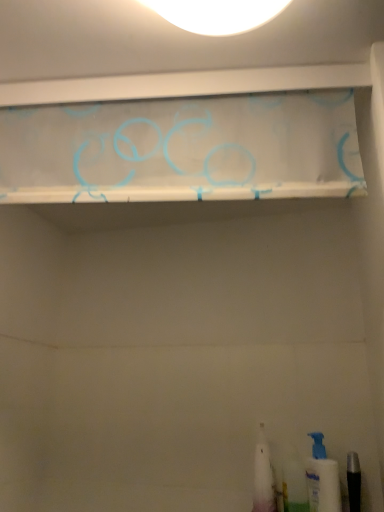
Question: Is white plastic toothbrush at lower right, positioned as the 3th toiletry in right-to-left order, taller than white plastic pump bottle at lower right, acting as the 3th toiletry starting from the left?

Choices:
 (A) no
 (B) yes

Answer: (B)

Question: From a real-world perspective, is white plastic toothbrush at lower right, the 1th toiletry in the left-to-right sequence, beneath white plastic pump bottle at lower right, the first toiletry when ordered from right to left?

Choices:
 (A) yes
 (B) no

Answer: (B)

Question: Considering the relative sizes of white plastic toothbrush at lower right, the 1th toiletry in the left-to-right sequence, and white plastic pump bottle at lower right, the first toiletry when ordered from right to left, in the image provided, is white plastic toothbrush at lower right, the 1th toiletry in the left-to-right sequence, smaller than white plastic pump bottle at lower right, the first toiletry when ordered from right to left,?

Choices:
 (A) yes
 (B) no

Answer: (B)

Question: Is white plastic pump bottle at lower right, the first toiletry when ordered from right to left, at the back of white plastic toothbrush at lower right, positioned as the 3th toiletry in right-to-left order?

Choices:
 (A) yes
 (B) no

Answer: (B)

Question: Does white plastic toothbrush at lower right, the 1th toiletry in the left-to-right sequence, appear on the left side of white plastic pump bottle at lower right, the first toiletry when ordered from right to left?

Choices:
 (A) no
 (B) yes

Answer: (B)

Question: Are white plastic toothbrush at lower right, the 1th toiletry in the left-to-right sequence, and white plastic pump bottle at lower right, acting as the 3th toiletry starting from the left, located far from each other?

Choices:
 (A) no
 (B) yes

Answer: (A)

Question: Does translucent fabric curtain at upper center have a greater height compared to translucent plastic toothbrush at lower right, the second toiletry in the left-to-right sequence?

Choices:
 (A) no
 (B) yes

Answer: (A)

Question: Is translucent fabric curtain at upper center to the right of translucent plastic toothbrush at lower right, the second toiletry in the left-to-right sequence, from the viewer's perspective?

Choices:
 (A) no
 (B) yes

Answer: (A)

Question: Is translucent fabric curtain at upper center not inside translucent plastic toothbrush at lower right, the second toiletry in the left-to-right sequence?

Choices:
 (A) no
 (B) yes

Answer: (B)

Question: Does translucent fabric curtain at upper center come behind translucent plastic toothbrush at lower right, the second toiletry in the left-to-right sequence?

Choices:
 (A) no
 (B) yes

Answer: (A)

Question: Is translucent fabric curtain at upper center oriented towards translucent plastic toothbrush at lower right, the second toiletry in the left-to-right sequence?

Choices:
 (A) no
 (B) yes

Answer: (A)

Question: Is translucent fabric curtain at upper center positioned in front of translucent plastic toothbrush at lower right, the second toiletry viewed from the right?

Choices:
 (A) yes
 (B) no

Answer: (A)

Question: Does translucent plastic toothbrush at lower right, the second toiletry viewed from the right, contain translucent fabric curtain at upper center?

Choices:
 (A) yes
 (B) no

Answer: (B)